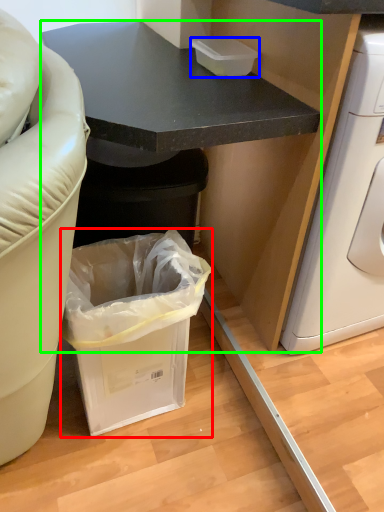
Question: Based on their relative distances, which object is farther from trash bin/can (highlighted by a red box)? Choose from box (highlighted by a blue box) and cabinetry (highlighted by a green box).

Choices:
 (A) box
 (B) cabinetry

Answer: (A)